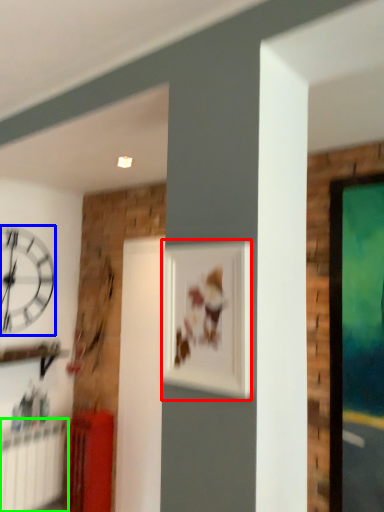
Question: Estimate the real-world distances between objects in this image. Which object is closer to picture frame (highlighted by a red box), wall clock (highlighted by a blue box) or radiator (highlighted by a green box)?

Choices:
 (A) wall clock
 (B) radiator

Answer: (A)